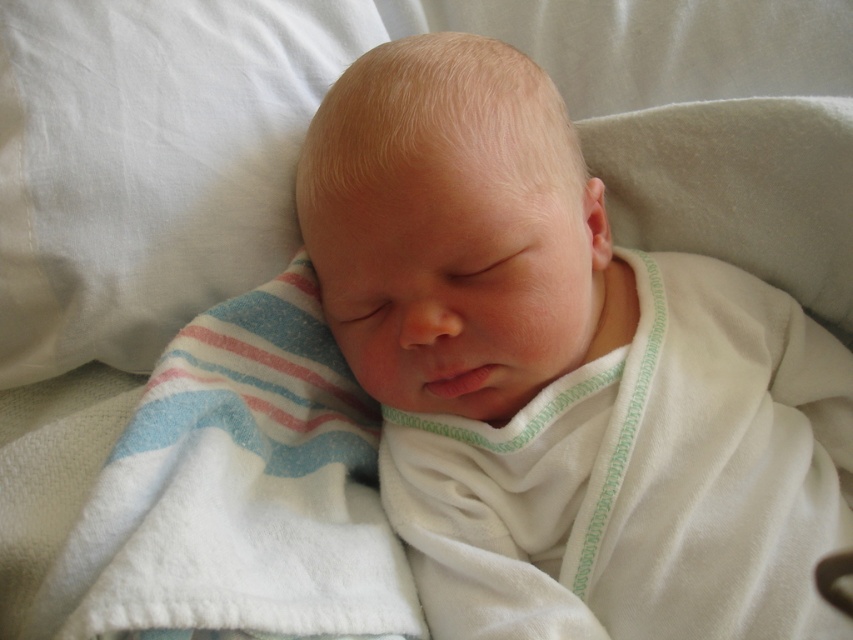
Question: Which point is farther from the camera taking this photo?

Choices:
 (A) (250, 618)
 (B) (263, 29)

Answer: (B)

Question: In this image, where is smooth white baby at center located relative to white cotton pillow at upper left?

Choices:
 (A) below
 (B) above

Answer: (A)

Question: Is smooth white baby at center in front of white cotton pillow at upper left?

Choices:
 (A) no
 (B) yes

Answer: (B)

Question: Considering the real-world distances, which object is farthest from the white cotton pillow at upper left?

Choices:
 (A) smooth white baby at center
 (B) white soft blanket at center

Answer: (A)

Question: Is white cotton pillow at upper left bigger than white soft blanket at center?

Choices:
 (A) no
 (B) yes

Answer: (A)

Question: Which of these objects is positioned farthest from the smooth white baby at center?

Choices:
 (A) white cotton pillow at upper left
 (B) white soft blanket at center

Answer: (A)